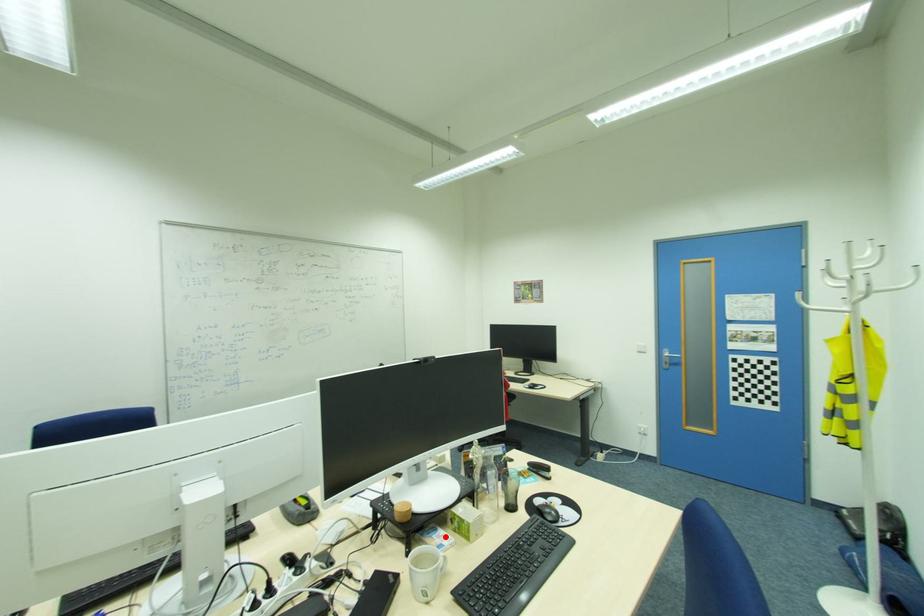
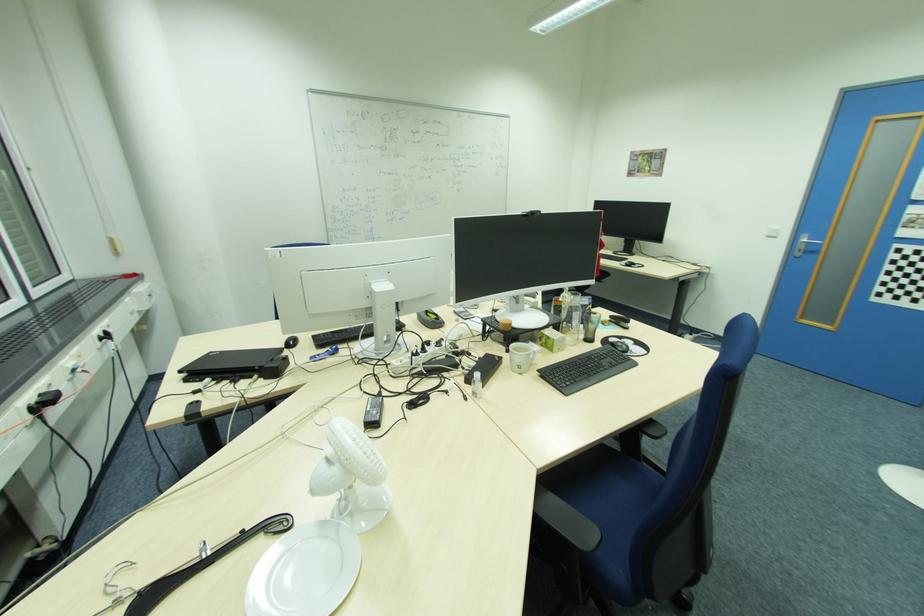
Find the pixel in the second image that matches the highlighted location in the first image.

(536, 346)